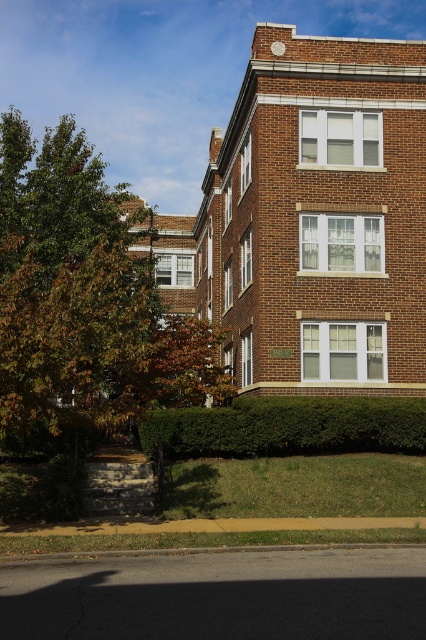
You are standing in front of the apartment building and want to walk from the green leafy tree at upper left to the green leafy hedge at lower center. Which direction should you move relative to the building?

The green leafy tree at upper left is to the left of the green leafy hedge at lower center, so you should move to the right towards the hedge.

Based on the photo, you are standing in front of the apartment building and want to determine which plant is taller between the green leafy tree at upper left and the green leafy hedge at lower center. Based on the scene, which one is taller?

The green leafy tree at upper left has a greater height compared to the green leafy hedge at lower center, so the green leafy tree at upper left is taller.